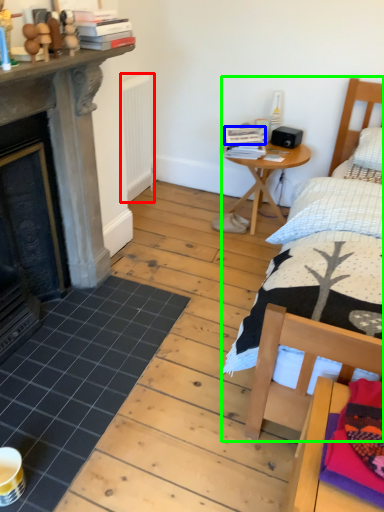
Question: Based on their relative distances, which object is farther from radiator (highlighted by a red box)? Choose from book (highlighted by a blue box) and bed (highlighted by a green box).

Choices:
 (A) book
 (B) bed

Answer: (B)